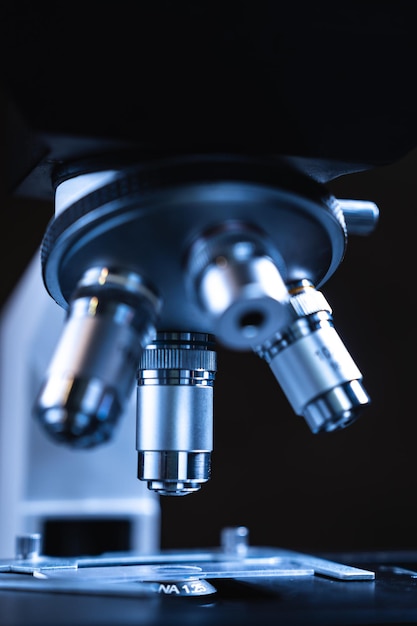
I want to click on screws, so click(x=23, y=544), click(x=237, y=538).